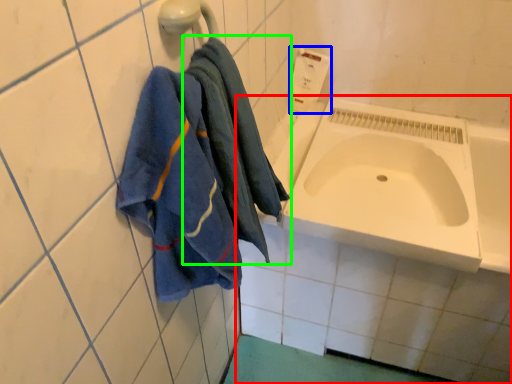
Question: Estimate the real-world distances between objects in this image. Which object is farther from bath (highlighted by a red box), soap dispenser (highlighted by a blue box) or towel (highlighted by a green box)?

Choices:
 (A) soap dispenser
 (B) towel

Answer: (A)